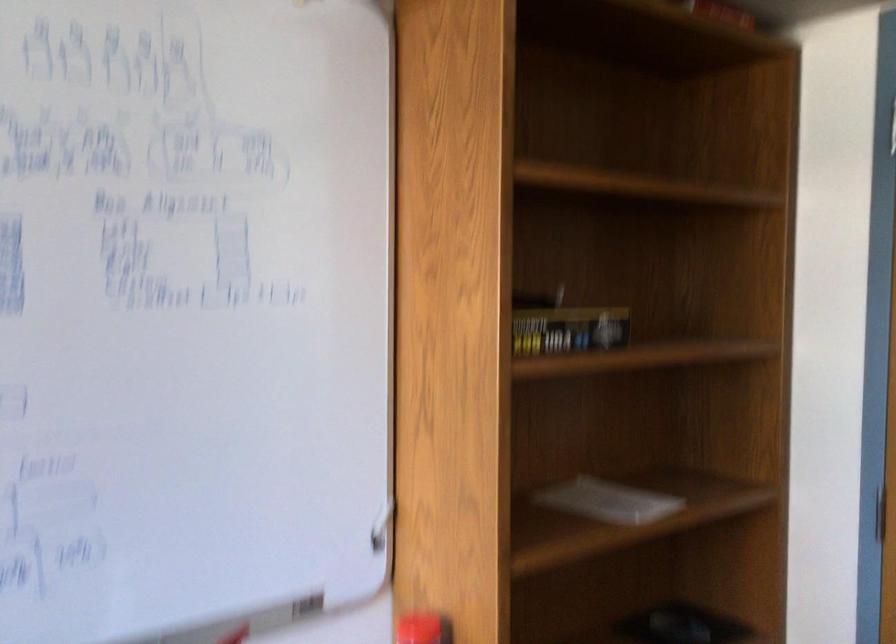
Question: The camera is either moving clockwise (left) or counter-clockwise (right) around the object. The first image is from the beginning of the video and the second image is from the end. Is the camera moving left or right when shooting the video?

Choices:
 (A) Left
 (B) Right

Answer: (A)